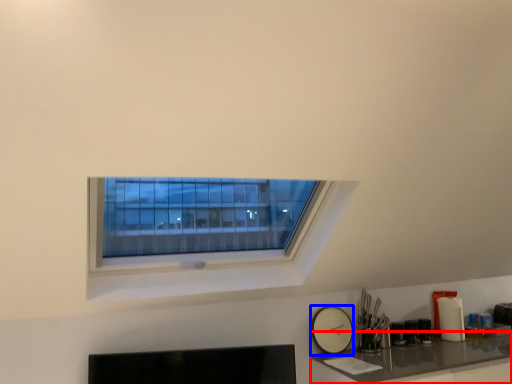
Question: Among these objects, which one is farthest to the camera, counter top (highlighted by a red box) or clock (highlighted by a blue box)?

Choices:
 (A) counter top
 (B) clock

Answer: (B)